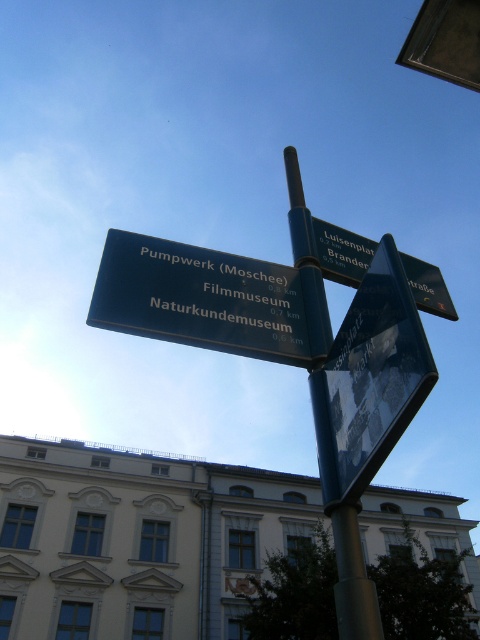
Which is behind, point (233, 275) or point (342, 244)?

Point (342, 244)

Between point (171, 268) and point (337, 241), which one is positioned in front?

Point (171, 268) is more forward.

Where is `green metallic sign at center`? The height and width of the screenshot is (640, 480). green metallic sign at center is located at coordinates (212, 298).

Between point (348, 330) and point (331, 227), which one is positioned in front?

Point (348, 330) is in front.

This screenshot has height=640, width=480. What do you see at coordinates (370, 380) in the screenshot?
I see `metallic reflective sign at center` at bounding box center [370, 380].

Looking at this image, who is more distant from viewer, (393, 432) or (434, 296)?

Positioned behind is point (434, 296).

Where is `metallic reflective sign at center`? Image resolution: width=480 pixels, height=640 pixels. metallic reflective sign at center is located at coordinates (370, 380).

Is metallic reflective sign at center positioned at the back of green metallic pole at center?

No, metallic reflective sign at center is closer to the viewer.

Which is behind, point (421, 387) or point (338, 518)?

The point (338, 518) is behind.

You are a GUI agent. You are given a task and a screenshot of the screen. Output one action in this format:
    pyautogui.click(x=<x>, y=<y>)
    Task: Click on the metallic reflective sign at center
    The image size is (480, 640).
    Given the screenshot: What is the action you would take?
    pyautogui.click(x=370, y=380)